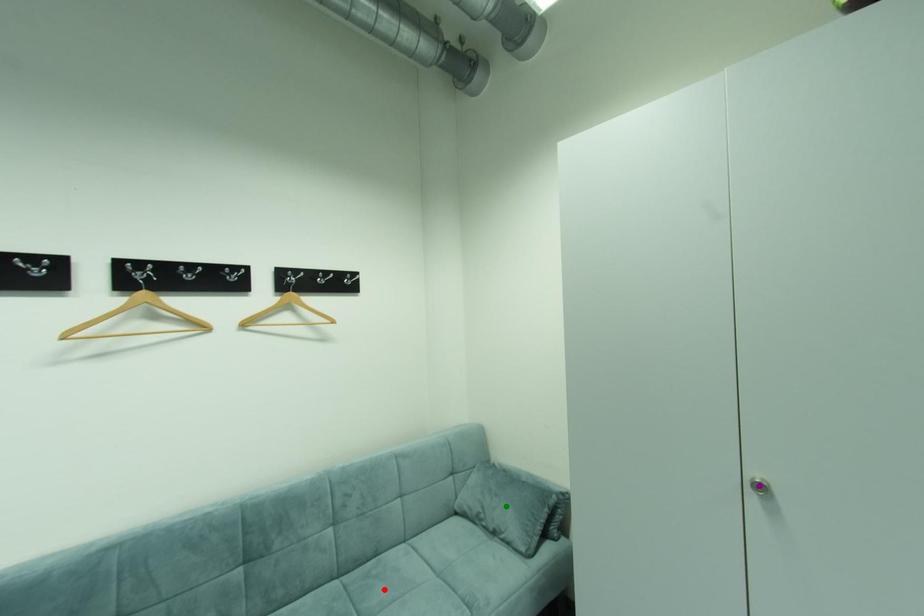
Order these from nearest to farthest:
green point, red point, purple point

purple point → red point → green point